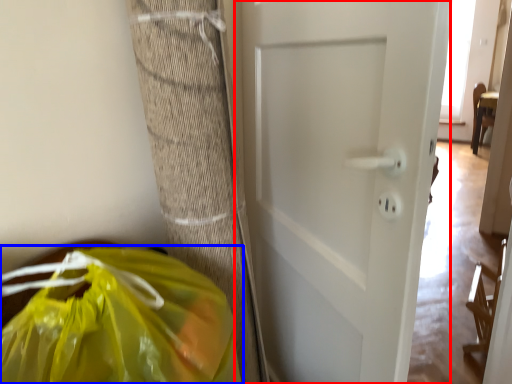
Question: Which of the following is the closest to the observer, door (highlighted by a red box) or plastic bag (highlighted by a blue box)?

Choices:
 (A) door
 (B) plastic bag

Answer: (B)